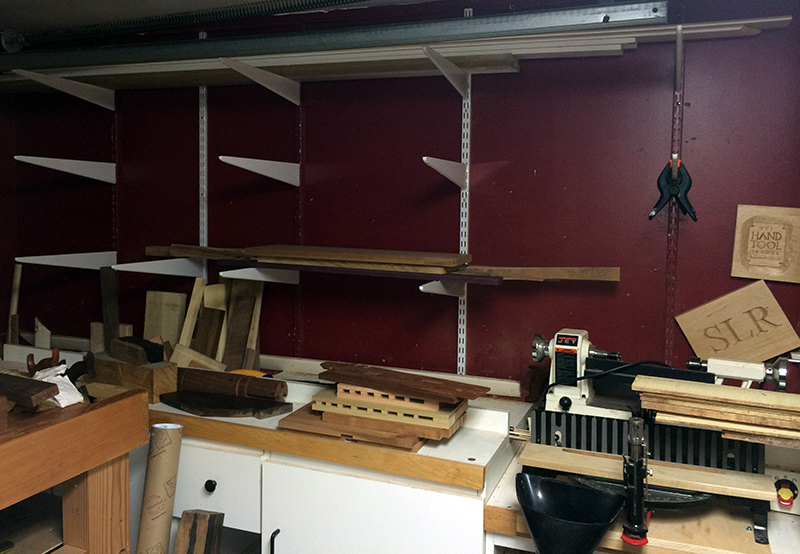
Identify the location of steel shelving bracket. This screenshot has height=554, width=800. (460, 322).